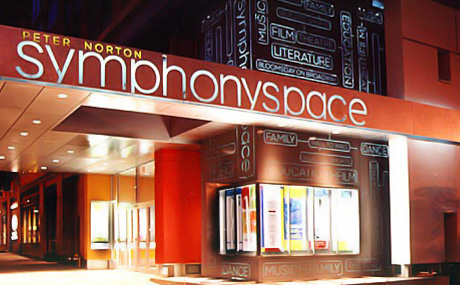
Where is `side main wall`? Image resolution: width=460 pixels, height=285 pixels. side main wall is located at coordinates (428, 178).